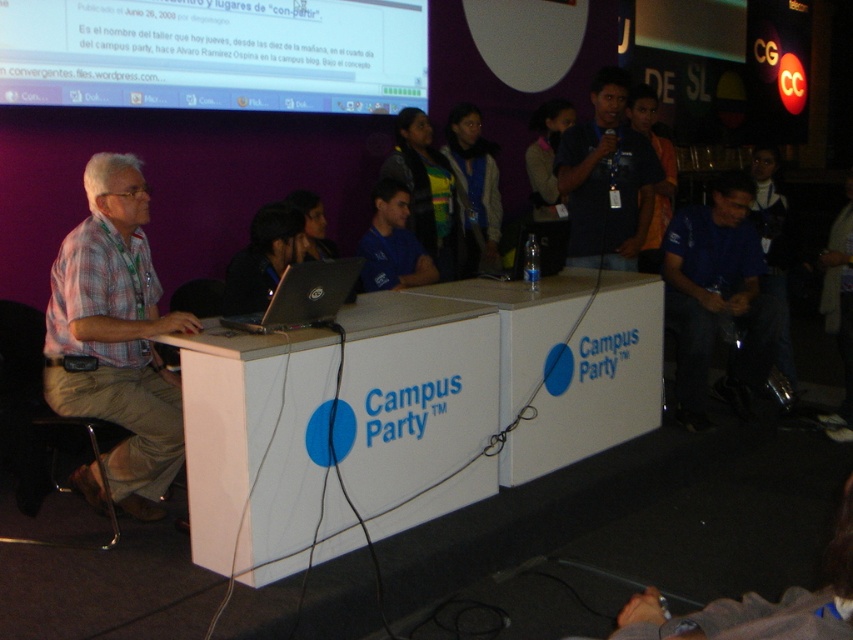
Between point (595, 244) and point (415, 280), which one is positioned behind?

Point (415, 280)

Can you confirm if black shirt at center is shorter than blue fabric shirt at center?

Incorrect, black shirt at center's height does not fall short of blue fabric shirt at center's.

Is point (599, 145) in front of point (367, 282)?

Yes, it is.

Find the location of a particular element. The image size is (853, 640). black shirt at center is located at coordinates (606, 179).

Is blue fabric shirt at lower right below black shirt at center?

Yes, blue fabric shirt at lower right is below black shirt at center.

The height and width of the screenshot is (640, 853). Find the location of `blue fabric shirt at lower right`. blue fabric shirt at lower right is located at coordinates (717, 298).

Image resolution: width=853 pixels, height=640 pixels. What are the coordinates of `blue fabric shirt at lower right` in the screenshot? It's located at (717, 298).

At what (x,y) coordinates should I click in order to perform the action: click on blue fabric shirt at lower right. Please return your answer as a coordinate pair (x, y). The image size is (853, 640). Looking at the image, I should click on 717,298.

The width and height of the screenshot is (853, 640). What are the coordinates of `yellow-green fabric jacket at center` in the screenshot? It's located at (474, 188).

Between yellow-green fabric jacket at center and blue fabric shirt at center, which one appears on the left side from the viewer's perspective?

blue fabric shirt at center

Is point (460, 152) behind point (412, 260)?

Yes, it is behind point (412, 260).

Locate an element on the screen. yellow-green fabric jacket at center is located at coordinates (474, 188).